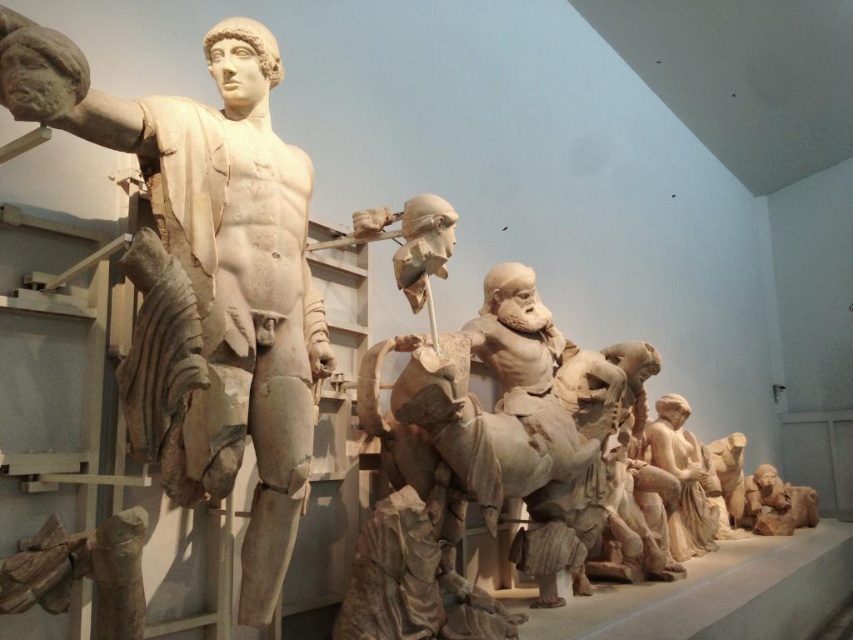
Does white marble statue at left have a greater width compared to smooth beige statue at lower right?

Yes.

Can you confirm if white marble statue at left is taller than smooth beige statue at lower right?

Correct, white marble statue at left is much taller as smooth beige statue at lower right.

Which is in front, point (253, 88) or point (666, 440)?

Point (253, 88) is more forward.

At what (x,y) coordinates should I click in order to perform the action: click on white marble statue at left. Please return your answer as a coordinate pair (x, y). Looking at the image, I should click on (213, 268).